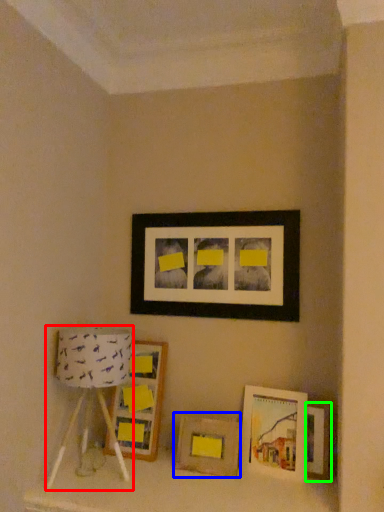
Question: Based on their relative distances, which object is nearer to table lamp (highlighted by a red box)? Choose from picture frame (highlighted by a blue box) and picture frame (highlighted by a green box).

Choices:
 (A) picture frame
 (B) picture frame

Answer: (A)